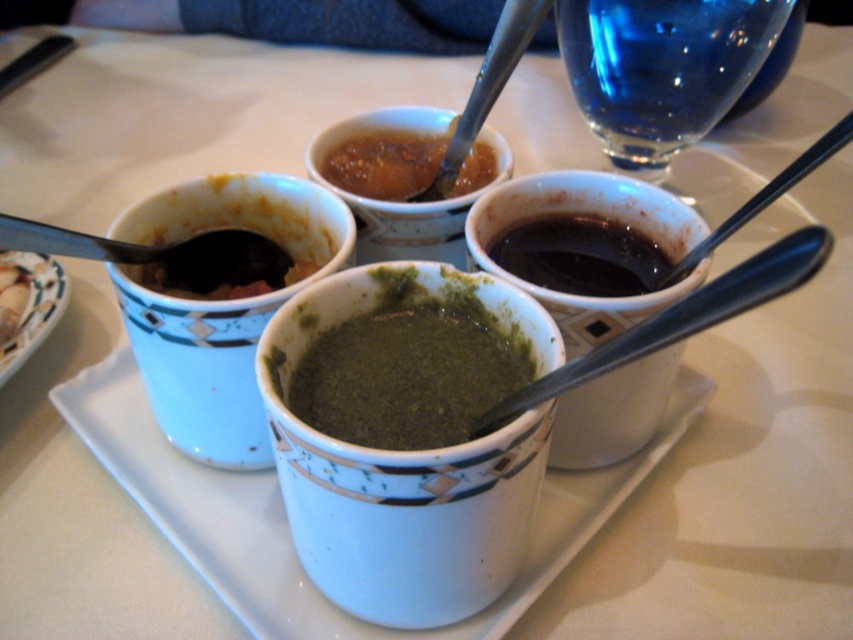
You are setting up a dining table and need to place the green matte soup at center and the matte ceramic bowl at lower left. According to the image, where should you position the bowl relative to the soup?

The green matte soup at center is below the matte ceramic bowl at lower left, so you should place the matte ceramic bowl at lower left above the green matte soup at center.

You are a delivery person who needs to place a small package exactly at the center of the tray. The tray has a green matte soup at center. Where should you place the package?

The green matte soup at center is located at point (409, 372), so you should place the package at that coordinate to ensure it is at the center of the tray.

You are a food delivery person who needs to place a hot bowl of soup on the tray. The bowl is 10 cm in diameter. The tray has a rectangular shape with dimensions 30 cm by 20 cm. The tray already has four small ceramic cups arranged as described. The point at coordinate (409, 372) on the tray marks the center of the green matte soup at center. Can you fit the bowl on the tray without overlapping any existing cups?

The point at coordinate (409, 372) marks the center of the green matte soup at center. Since the bowl is 10 cm in diameter, it requires a space of at least 10 cm in both length and width. The tray measures 30 cm by 20 cm, so there might be enough space if the bowl is placed away from the existing cups. However, the exact placement depends on the arrangement of the cups. Without knowing their exact positions, it is uncertain if the bowl will fit without overlapping.